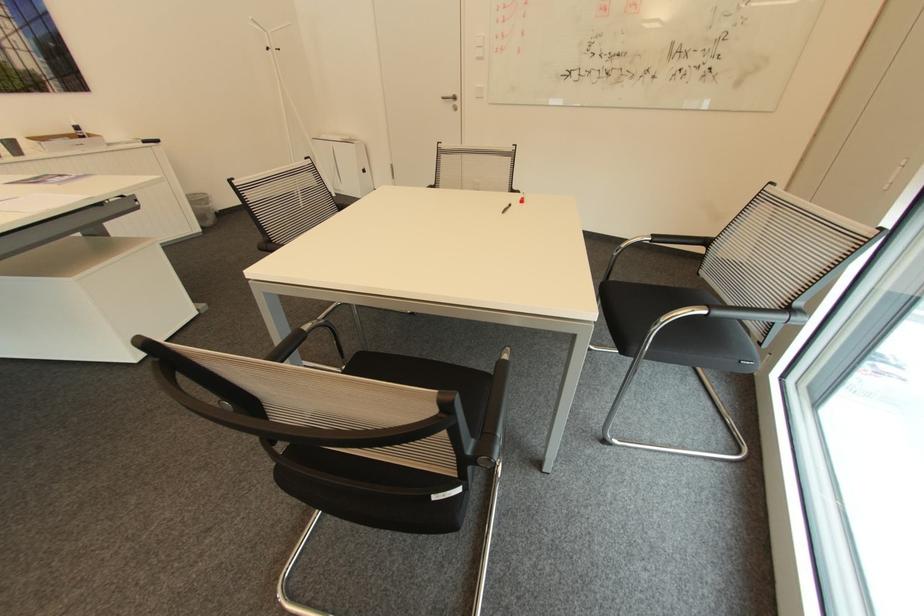
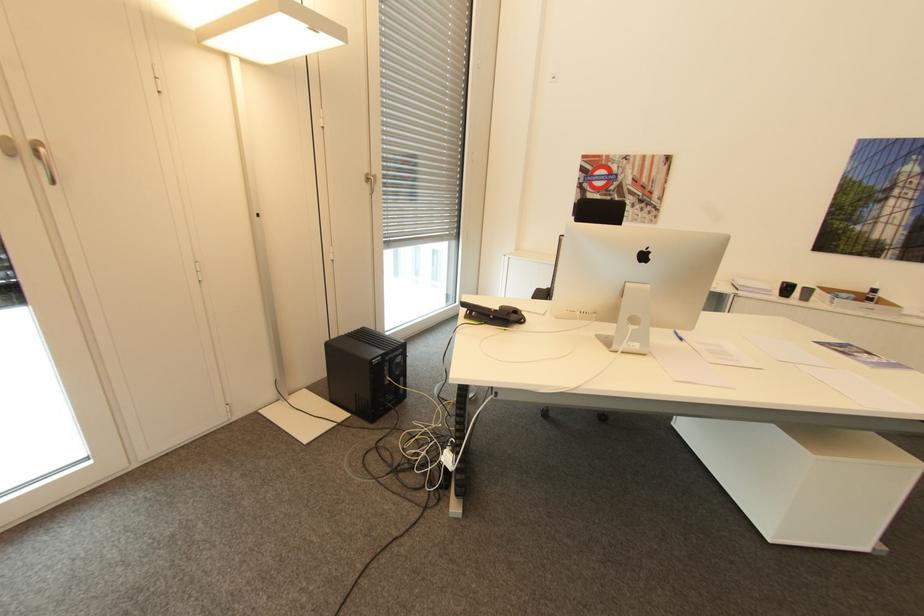
The images are taken continuously from a first-person perspective. In which direction is your viewpoint rotating?

The camera's rotation is toward left-down.